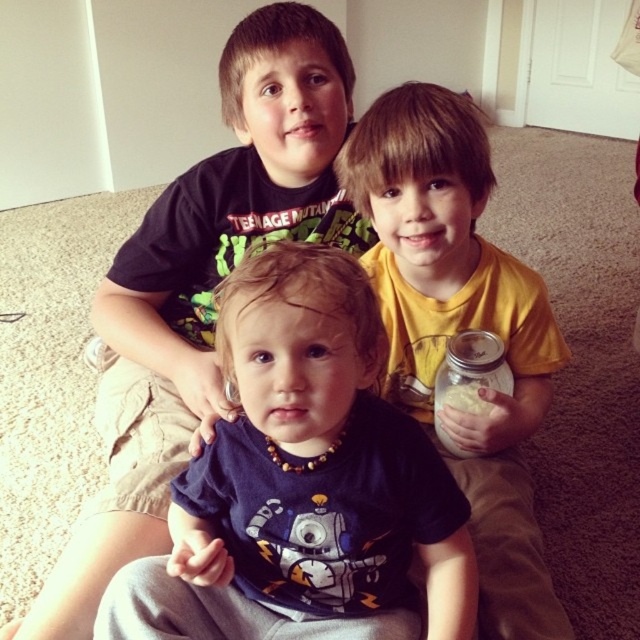
You are a photographer taking a picture of the blue fabric shirt at center and the clear glass jar at center. Which object should you focus on first if you want to capture both in focus?

The blue fabric shirt at center is to the left of the clear glass jar at center, so focusing on the blue fabric shirt at center first would help ensure both are in focus since it is closer to the camera.